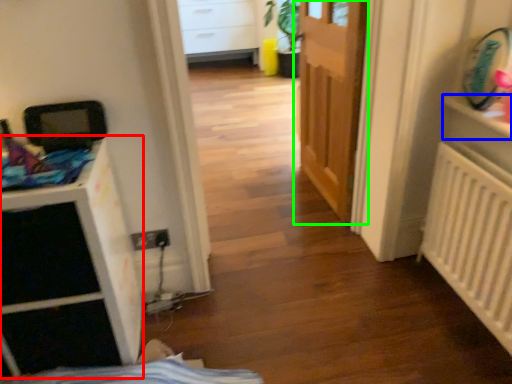
Question: Based on their relative distances, which object is nearer to file cabinet (highlighted by a red box)? Choose from shelf (highlighted by a blue box) and door (highlighted by a green box).

Choices:
 (A) shelf
 (B) door

Answer: (B)